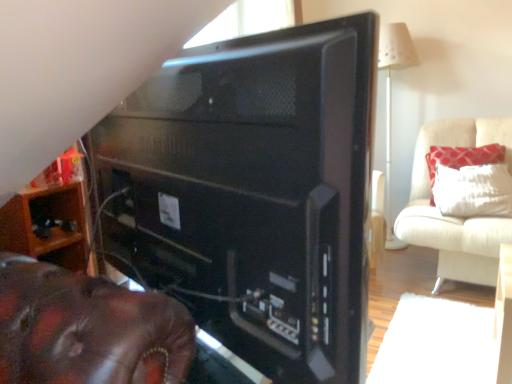
Question: Can you confirm if black matte desktop computer at center is smaller than wooden shelf at lower left, which ranks as the second furniture in right-to-left order?

Choices:
 (A) no
 (B) yes

Answer: (A)

Question: Could you tell me if black matte desktop computer at center is facing wooden shelf at lower left, placed as the 1th furniture when sorted from left to right?

Choices:
 (A) yes
 (B) no

Answer: (B)

Question: Is black matte desktop computer at center taller than wooden shelf at lower left, which ranks as the second furniture in right-to-left order?

Choices:
 (A) yes
 (B) no

Answer: (A)

Question: Does black matte desktop computer at center have a greater width compared to wooden shelf at lower left, positioned as the second furniture in back-to-front order?

Choices:
 (A) no
 (B) yes

Answer: (A)

Question: Is black matte desktop computer at center with wooden shelf at lower left, which ranks as the second furniture in right-to-left order?

Choices:
 (A) yes
 (B) no

Answer: (B)

Question: From a real-world perspective, is black matte desktop computer at center positioned above or below white textured pillow at upper right?

Choices:
 (A) above
 (B) below

Answer: (A)

Question: Is black matte desktop computer at center taller or shorter than white textured pillow at upper right?

Choices:
 (A) short
 (B) tall

Answer: (B)

Question: Considering the positions of point (224, 41) and point (488, 157), is point (224, 41) closer or farther from the camera than point (488, 157)?

Choices:
 (A) closer
 (B) farther

Answer: (A)

Question: From the image's perspective, relative to white textured pillow at upper right, is black matte desktop computer at center above or below?

Choices:
 (A) above
 (B) below

Answer: (B)

Question: Considering the positions of wooden shelf at lower left, which ranks as the first furniture in front-to-back order, and black matte desktop computer at center in the image, is wooden shelf at lower left, which ranks as the first furniture in front-to-back order, wider or thinner than black matte desktop computer at center?

Choices:
 (A) thin
 (B) wide

Answer: (B)

Question: From the image's perspective, is wooden shelf at lower left, which ranks as the second furniture in right-to-left order, located above or below black matte desktop computer at center?

Choices:
 (A) below
 (B) above

Answer: (A)

Question: In the image, is wooden shelf at lower left, placed as the 1th furniture when sorted from left to right, on the left side or the right side of black matte desktop computer at center?

Choices:
 (A) right
 (B) left

Answer: (B)

Question: In terms of size, does wooden shelf at lower left, positioned as the second furniture in back-to-front order, appear bigger or smaller than black matte desktop computer at center?

Choices:
 (A) big
 (B) small

Answer: (B)

Question: Considering the positions of wooden shelf at lower left, placed as the 1th furniture when sorted from left to right, and white textured pillow at upper right in the image, is wooden shelf at lower left, placed as the 1th furniture when sorted from left to right, taller or shorter than white textured pillow at upper right?

Choices:
 (A) short
 (B) tall

Answer: (A)

Question: Is wooden shelf at lower left, placed as the 1th furniture when sorted from left to right, in front of or behind white textured pillow at upper right in the image?

Choices:
 (A) front
 (B) behind

Answer: (A)